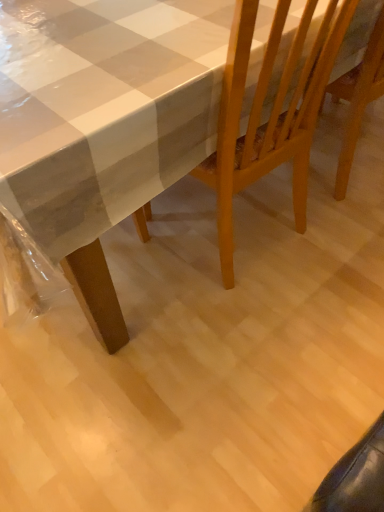
Question: Considering the positions of point (231, 259) and point (33, 18), is point (231, 259) closer or farther from the camera than point (33, 18)?

Choices:
 (A) farther
 (B) closer

Answer: (A)

Question: Would you say wooden chair at center is inside or outside white glossy table at upper left?

Choices:
 (A) outside
 (B) inside

Answer: (B)

Question: Based on their positions, is wooden chair at center located to the left or right of white glossy table at upper left?

Choices:
 (A) right
 (B) left

Answer: (A)

Question: Which is correct: white glossy table at upper left is inside wooden chair at center, or outside of it?

Choices:
 (A) outside
 (B) inside

Answer: (A)

Question: In terms of height, does white glossy table at upper left look taller or shorter compared to wooden chair at center?

Choices:
 (A) tall
 (B) short

Answer: (B)

Question: From a real-world perspective, is white glossy table at upper left positioned above or below wooden chair at center?

Choices:
 (A) above
 (B) below

Answer: (B)

Question: From the image's perspective, is white glossy table at upper left located above or below wooden chair at center?

Choices:
 (A) below
 (B) above

Answer: (B)